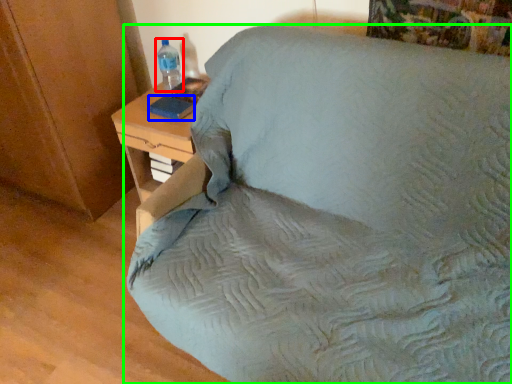
Question: Considering the real-world distances, which object is farthest from bottle (highlighted by a red box)? pad (highlighted by a blue box) or furniture (highlighted by a green box)?

Choices:
 (A) pad
 (B) furniture

Answer: (B)